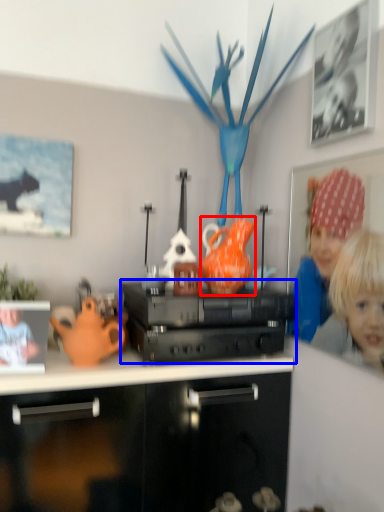
Question: Which of the following is the farthest to the observer, tea pot (highlighted by a red box) or appliance (highlighted by a blue box)?

Choices:
 (A) tea pot
 (B) appliance

Answer: (A)